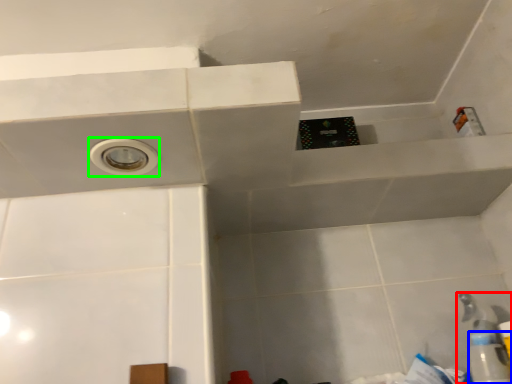
Question: Which object is the farthest from plumbing fixture (highlighted by a red box)? Choose among these: bottle (highlighted by a blue box) or hole (highlighted by a green box).

Choices:
 (A) bottle
 (B) hole

Answer: (B)